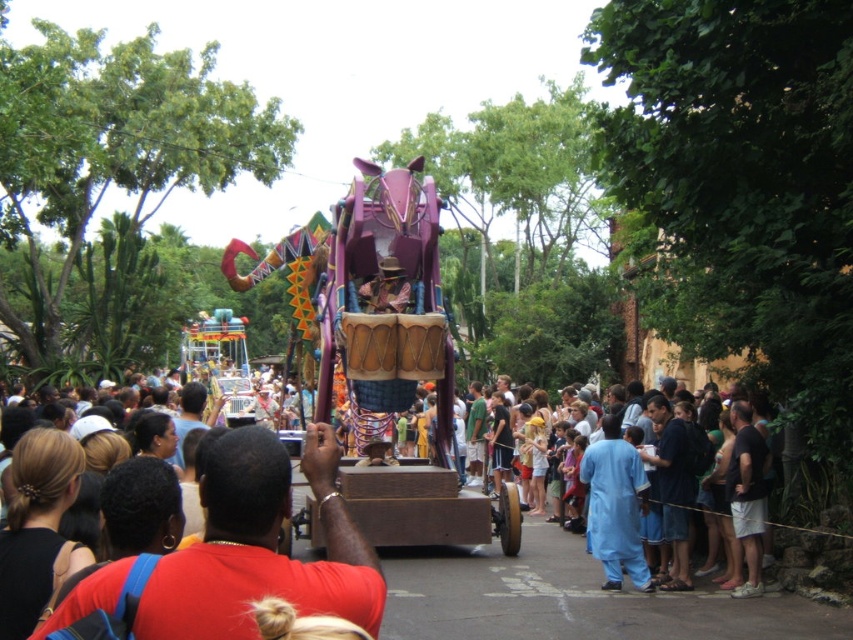
Can you confirm if red matte shirt at center is taller than blue cotton pants at center?

No, red matte shirt at center is not taller than blue cotton pants at center.

Between red matte shirt at center and blue cotton pants at center, which one has more height?

blue cotton pants at center

Between point (317, 592) and point (601, 442), which one is positioned behind?

The point (601, 442) is behind.

This screenshot has height=640, width=853. In order to click on red matte shirt at center in this screenshot , I will do `click(260, 547)`.